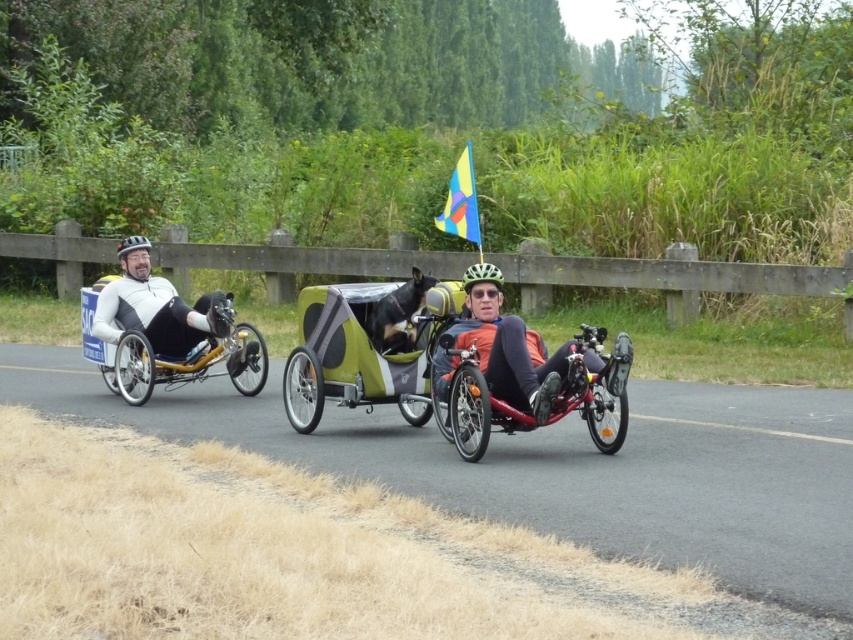
Question: Which point appears farthest from the camera in this image?

Choices:
 (A) (529, 368)
 (B) (253, 333)

Answer: (B)

Question: Estimate the real-world distances between objects in this image. Which object is closer to the red matte trike at center?

Choices:
 (A) green textured cargo bike at center
 (B) orange fabric trike at center
 (C) white matte cycling suit at left
 (D) matte black wheelchair at left

Answer: (B)

Question: Does green textured cargo bike at center appear under white matte cycling suit at left?

Choices:
 (A) no
 (B) yes

Answer: (B)

Question: Can you confirm if red matte trike at center is positioned to the right of white matte cycling suit at left?

Choices:
 (A) yes
 (B) no

Answer: (A)

Question: Which object is positioned farthest from the matte black wheelchair at left?

Choices:
 (A) green textured cargo bike at center
 (B) white matte cycling suit at left
 (C) orange fabric trike at center
 (D) red matte trike at center

Answer: (D)

Question: Does green textured cargo bike at center have a greater width compared to matte black wheelchair at left?

Choices:
 (A) yes
 (B) no

Answer: (B)